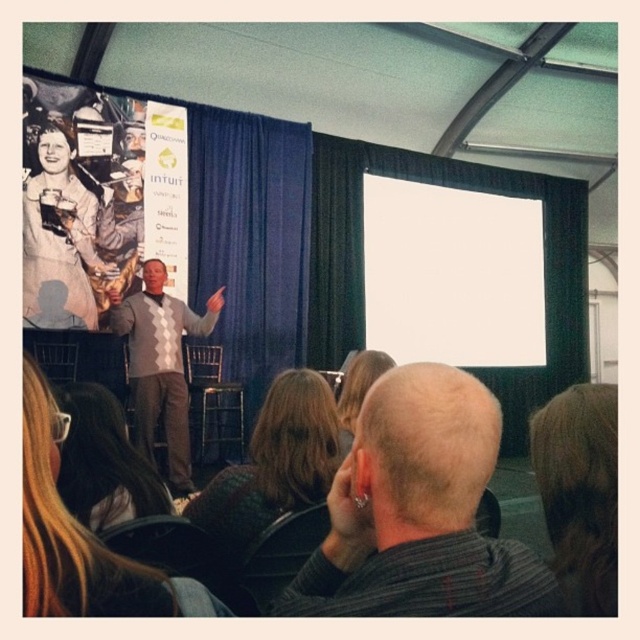
Which of these two, gray striped sweater at lower center or blonde hair at center, stands taller?

Standing taller between the two is gray striped sweater at lower center.

Who is more forward, (403, 451) or (65, 424)?

Point (403, 451) is in front.

Find the location of a particular element. The image size is (640, 640). gray striped sweater at lower center is located at coordinates (419, 513).

Who is more forward, (592, 556) or (365, 358)?

Point (592, 556)

Who is more distant from viewer, (x=595, y=508) or (x=372, y=369)?

The point (x=372, y=369) is behind.

Locate an element on the screen. The width and height of the screenshot is (640, 640). brown hair at upper right is located at coordinates (579, 490).

Is white matte projection screen at center above bald head at center?

Indeed, white matte projection screen at center is positioned over bald head at center.

Between white matte projection screen at center and bald head at center, which one appears on the right side from the viewer's perspective?

white matte projection screen at center

Image resolution: width=640 pixels, height=640 pixels. Describe the element at coordinates (452, 275) in the screenshot. I see `white matte projection screen at center` at that location.

This screenshot has height=640, width=640. I want to click on white matte projection screen at center, so click(452, 275).